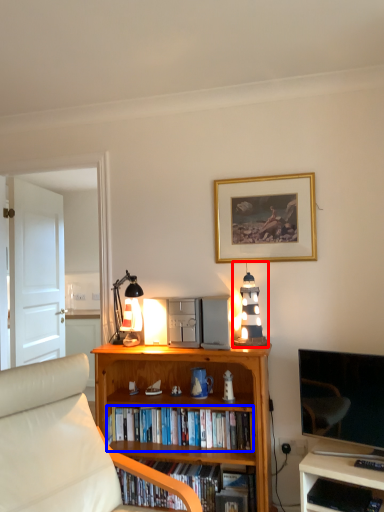
Question: Which of the following is the farthest to the observer, lamp (highlighted by a red box) or book (highlighted by a blue box)?

Choices:
 (A) lamp
 (B) book

Answer: (A)